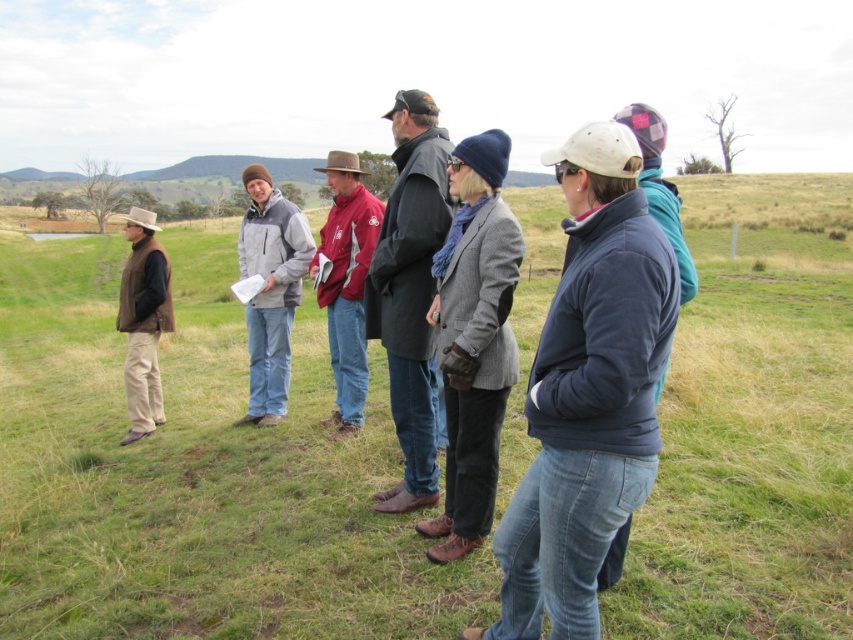
Question: Which point is closer to the camera?

Choices:
 (A) (489, 465)
 (B) (354, 192)
 (C) (613, 534)

Answer: (C)

Question: Can you confirm if gray matte jacket at center is thinner than matte red jacket at center?

Choices:
 (A) no
 (B) yes

Answer: (B)

Question: Where is gray woolen blazer at center located in relation to gray matte jacket at center in the image?

Choices:
 (A) above
 (B) below

Answer: (B)

Question: Based on their relative distances, which object is farther from the gray woolen blazer at center?

Choices:
 (A) gray matte jacket at center
 (B) denim jacket at center
 (C) dark gray coat at center

Answer: (A)

Question: Which of these objects is positioned closest to the gray matte jacket at center?

Choices:
 (A) matte brown vest at left
 (B) matte red jacket at center

Answer: (B)

Question: Can you confirm if gray woolen blazer at center is positioned to the left of matte brown vest at left?

Choices:
 (A) no
 (B) yes

Answer: (A)